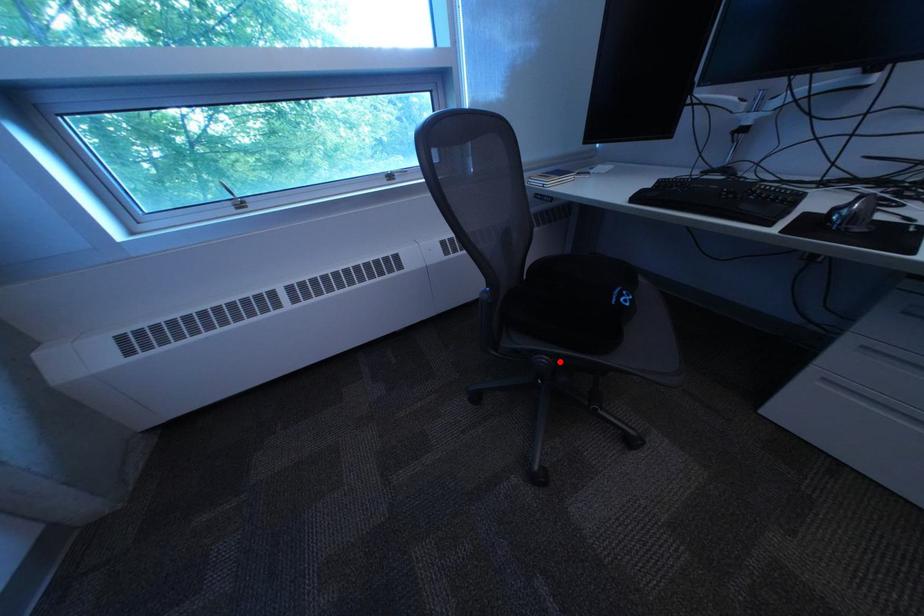
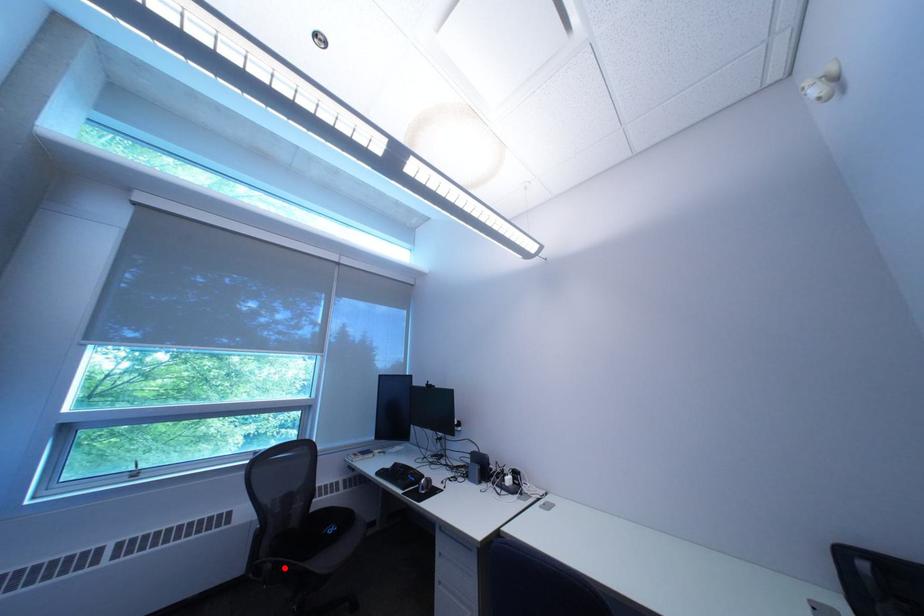
I am providing you with two images of the same scene from different viewpoints. A red point is marked on the first image and another point is marked on the second image. Does the point marked in image1 correspond to the same location as the one in image2?

Yes